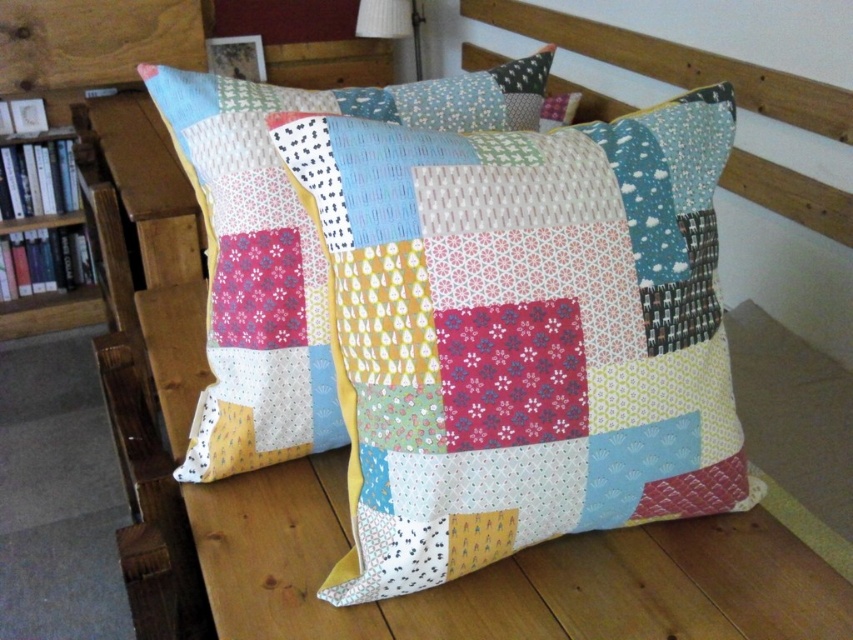
Is patchwork fabric pillow at center positioned behind wooden bookcase at left?

No, it is in front of wooden bookcase at left.

Is patchwork fabric pillow at center taller than wooden bookcase at left?

In fact, patchwork fabric pillow at center may be shorter than wooden bookcase at left.

Is point (523, 424) farther from viewer compared to point (19, 173)?

No.

Locate an element on the screen. This screenshot has height=640, width=853. patchwork fabric pillow at center is located at coordinates (521, 332).

Which is more to the left, patchwork fabric pillow at center or white fabric lampshade at upper center?

white fabric lampshade at upper center

Locate an element on the screen. The width and height of the screenshot is (853, 640). patchwork fabric pillow at center is located at coordinates (521, 332).

Between point (80, 168) and point (355, 22), which one is positioned in front?

Point (80, 168) is in front.

Who is positioned more to the right, wooden bookcase at left or white fabric lampshade at upper center?

white fabric lampshade at upper center

This screenshot has height=640, width=853. Find the location of `wooden bookcase at left`. wooden bookcase at left is located at coordinates (62, 236).